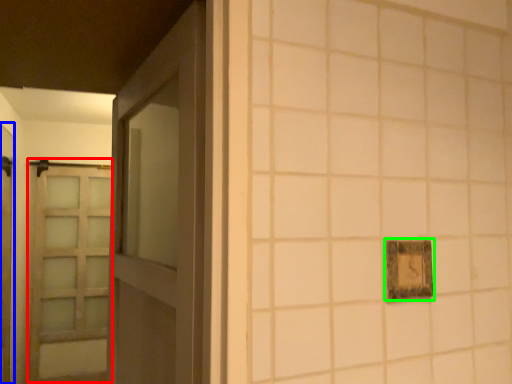
Question: Which object is the closest to the barn door (highlighted by a red box)? Choose among these: elevator (highlighted by a blue box) or picture frame (highlighted by a green box).

Choices:
 (A) elevator
 (B) picture frame

Answer: (A)